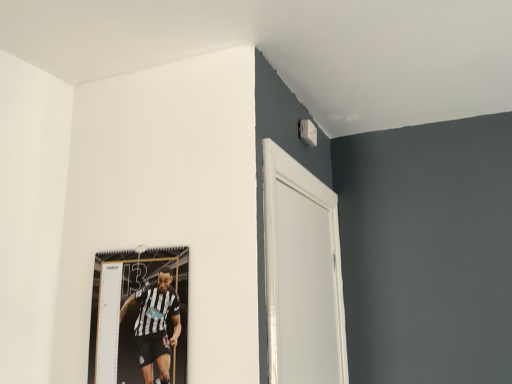
Measure the distance between black and white jersey at upper left and camera.

black and white jersey at upper left is 1.02 meters away from camera.

Describe the element at coordinates (155, 324) in the screenshot. I see `black and white jersey at upper left` at that location.

In the scene shown: What is the approximate width of black and white jersey at upper left?

It is 1.21 inches.

The height and width of the screenshot is (384, 512). I want to click on black and white jersey at upper left, so click(155, 324).

What do you see at coordinates (302, 274) in the screenshot? I see `white glossy door at upper right` at bounding box center [302, 274].

Locate an element on the screen. white glossy door at upper right is located at coordinates (302, 274).

Identify the location of black and white jersey at upper left. The height and width of the screenshot is (384, 512). point(155,324).

Which is more to the right, white glossy door at upper right or black and white jersey at upper left?

From the viewer's perspective, white glossy door at upper right appears more on the right side.

Which object is closer to the camera, white glossy door at upper right or black and white jersey at upper left?

white glossy door at upper right is more forward.

Which is nearer, (265, 163) or (164, 279)?

The point (265, 163) is in front.

From the picture: From the image's perspective, which one is positioned lower, white glossy door at upper right or black and white jersey at upper left?

From the image's view, black and white jersey at upper left is below.

From a real-world perspective, which object rests below the other?

From a 3D spatial view, black and white jersey at upper left is below.

Is white glossy door at upper right wider or thinner than black and white jersey at upper left?

In the image, white glossy door at upper right appears to be wider than black and white jersey at upper left.

Is white glossy door at upper right shorter than black and white jersey at upper left?

No.

Considering the sizes of objects white glossy door at upper right and black and white jersey at upper left in the image provided, who is bigger, white glossy door at upper right or black and white jersey at upper left?

white glossy door at upper right is bigger.

Can black and white jersey at upper left be found inside white glossy door at upper right?

No, black and white jersey at upper left is not inside white glossy door at upper right.

Does white glossy door at upper right touch black and white jersey at upper left?

No, white glossy door at upper right is not in contact with black and white jersey at upper left.

Is white glossy door at upper right facing away from black and white jersey at upper left?

Yes, white glossy door at upper right is facing away from black and white jersey at upper left.

Identify the location of door on the right of black and white jersey at upper left. The image size is (512, 384). (302, 274).

Based on the photo, which is more to the right, black and white jersey at upper left or white glossy door at upper right?

Positioned to the right is white glossy door at upper right.

Which object is closer to the camera taking this photo, black and white jersey at upper left or white glossy door at upper right?

white glossy door at upper right is closer to the camera.

Which point is more forward, (x=136, y=332) or (x=337, y=280)?

Positioned in front is point (x=136, y=332).

From the image's perspective, is black and white jersey at upper left positioned above or below white glossy door at upper right?

black and white jersey at upper left is below white glossy door at upper right.

From a real-world perspective, does black and white jersey at upper left sit lower than white glossy door at upper right?

Indeed, from a real-world perspective, black and white jersey at upper left is positioned beneath white glossy door at upper right.

Can you confirm if black and white jersey at upper left is wider than white glossy door at upper right?

Incorrect, the width of black and white jersey at upper left does not surpass that of white glossy door at upper right.

From their relative heights in the image, would you say black and white jersey at upper left is taller or shorter than white glossy door at upper right?

Considering their sizes, black and white jersey at upper left has less height than white glossy door at upper right.

Looking at the image, does black and white jersey at upper left seem bigger or smaller compared to white glossy door at upper right?

Clearly, black and white jersey at upper left is smaller in size than white glossy door at upper right.

Is black and white jersey at upper left outside of white glossy door at upper right?

black and white jersey at upper left is positioned outside white glossy door at upper right.

Are black and white jersey at upper left and white glossy door at upper right beside each other?

No, black and white jersey at upper left is not with white glossy door at upper right.

Is white glossy door at upper right at the back of black and white jersey at upper left?

No, white glossy door at upper right is not at the back of black and white jersey at upper left.

What's the angular difference between black and white jersey at upper left and white glossy door at upper right's facing directions?

black and white jersey at upper left and white glossy door at upper right are facing 91.2 degrees away from each other.

Find the location of a particular element. This screenshot has width=512, height=384. door that appears on the right of black and white jersey at upper left is located at coordinates (302, 274).

What are the coordinates of `person lying below the white glossy door at upper right (from the image's perspective)` in the screenshot? It's located at (155, 324).

Where is `door on the right of black and white jersey at upper left`? The image size is (512, 384). door on the right of black and white jersey at upper left is located at coordinates (302, 274).